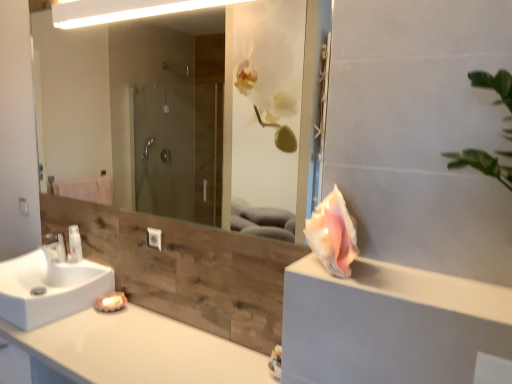
Where is `vacant area to the right of pink shell at right`? The width and height of the screenshot is (512, 384). vacant area to the right of pink shell at right is located at coordinates (404, 274).